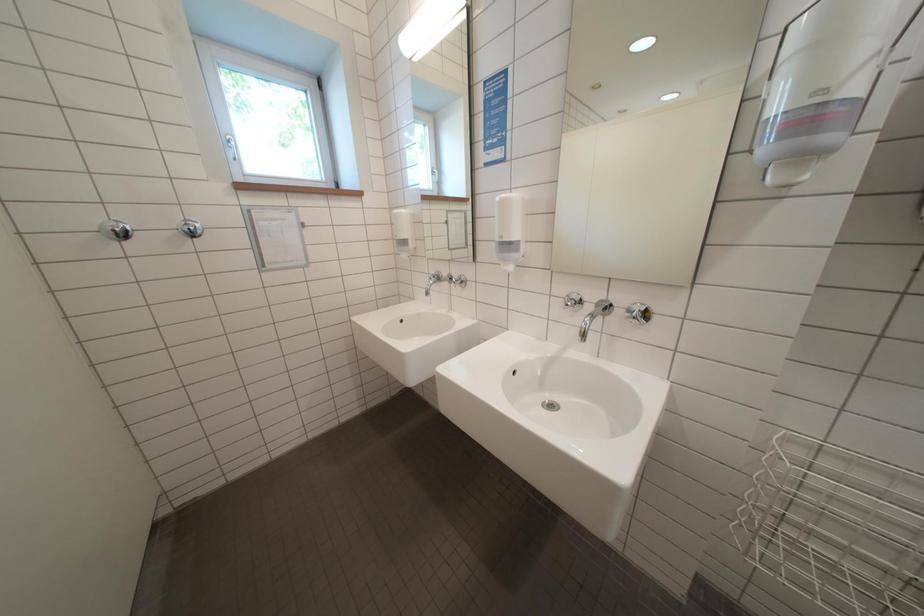
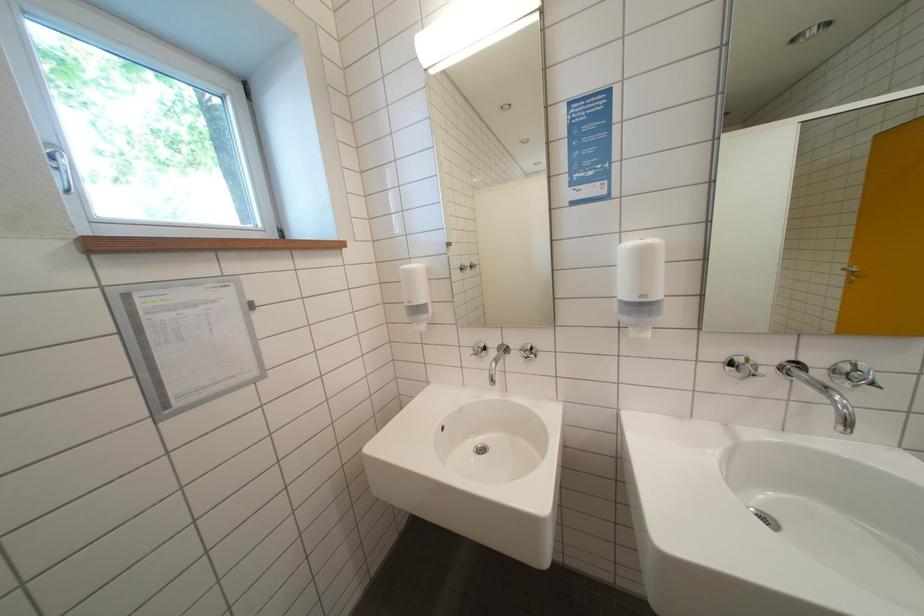
Question: How did the camera likely rotate?

Choices:
 (A) Left
 (B) Right
 (C) Up
 (D) Down

Answer: (B)